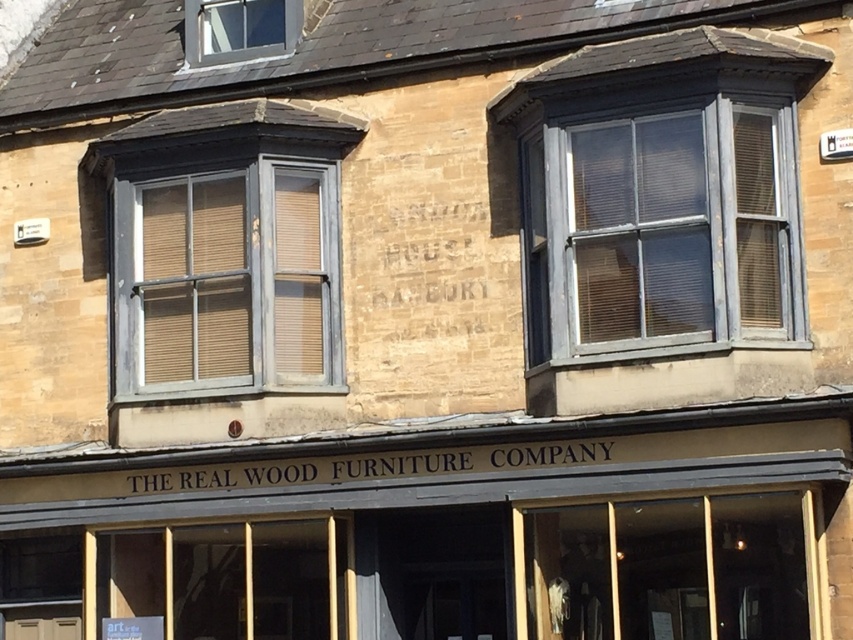
You are standing in front of the building and want to see through the windows. Which window, the matte gray wood window at center left or the clear glass window at upper left, would allow you to see the interior better?

The clear glass window at upper left would allow you to see the interior better because it is made of clear glass, while the matte gray wood window at center left is likely opaque due to its material and description.